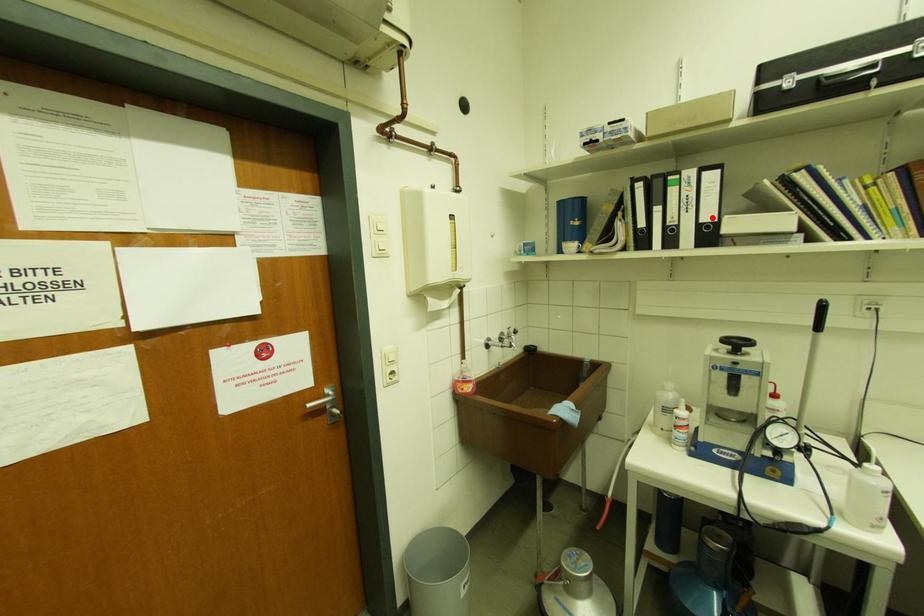
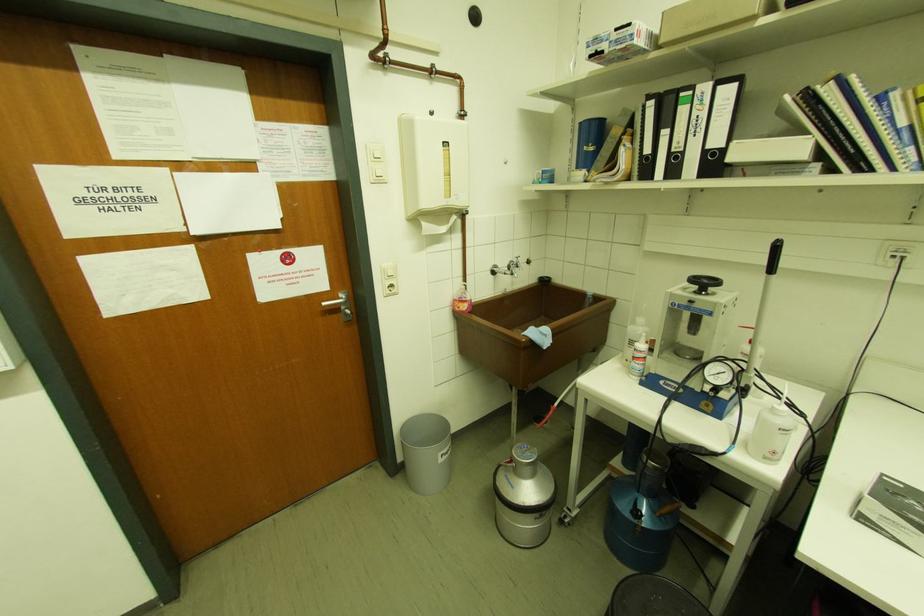
Question: I am providing you with two images of the same scene from different viewpoints. A red point is marked on the first image. At the location where the point appears in image 1, is it still visible in image 2?

Choices:
 (A) Yes
 (B) No

Answer: (A)